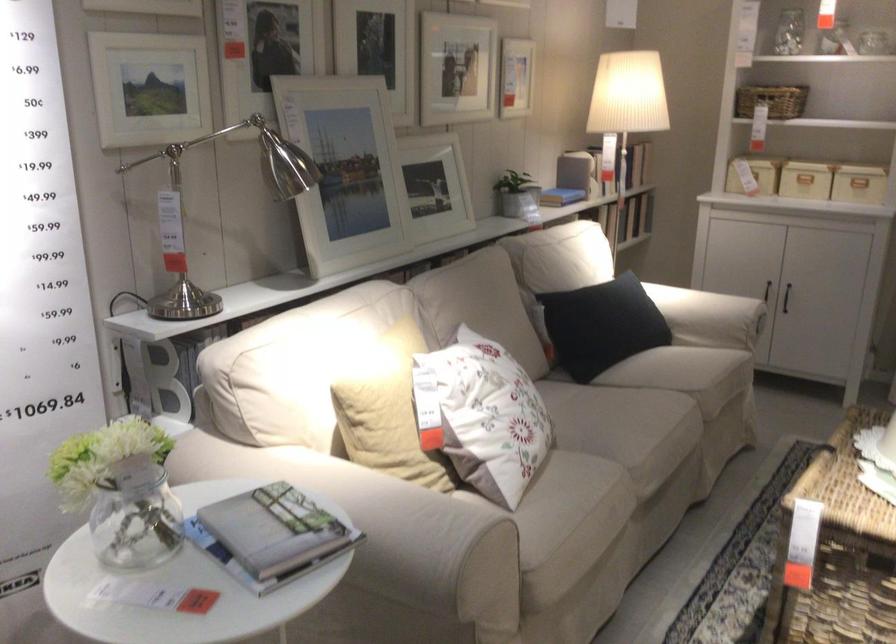
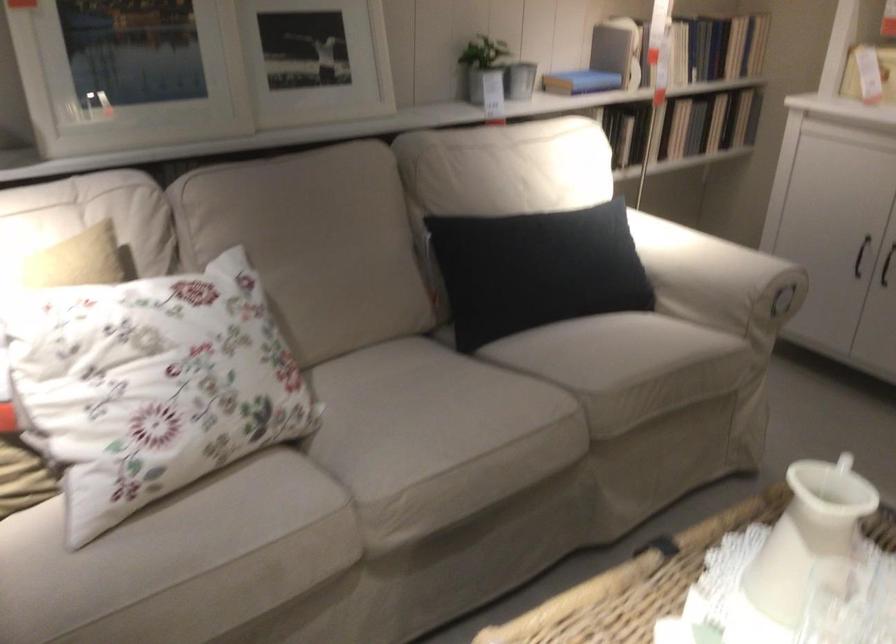
The point at (x=774, y=285) is marked in the first image. Where is the corresponding point in the second image?

(860, 256)